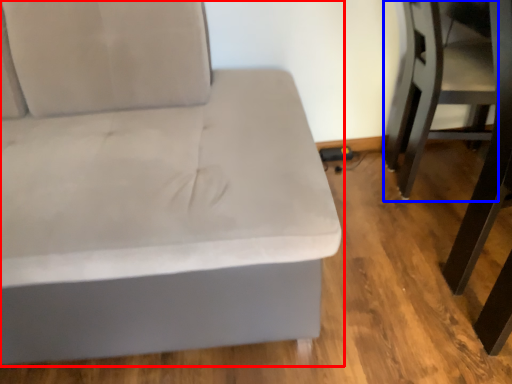
Question: Which object is further to the camera taking this photo, studio couch (highlighted by a red box) or swivel chair (highlighted by a blue box)?

Choices:
 (A) studio couch
 (B) swivel chair

Answer: (B)